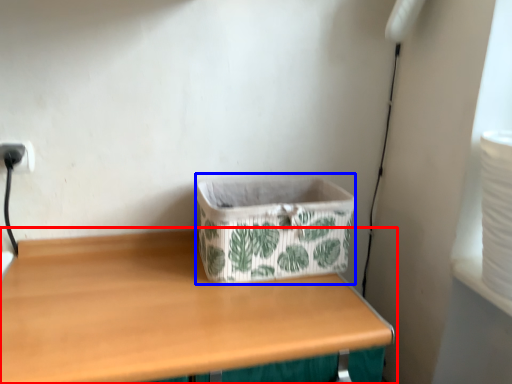
Question: Which object is further to the camera taking this photo, table (highlighted by a red box) or storage box (highlighted by a blue box)?

Choices:
 (A) table
 (B) storage box

Answer: (B)